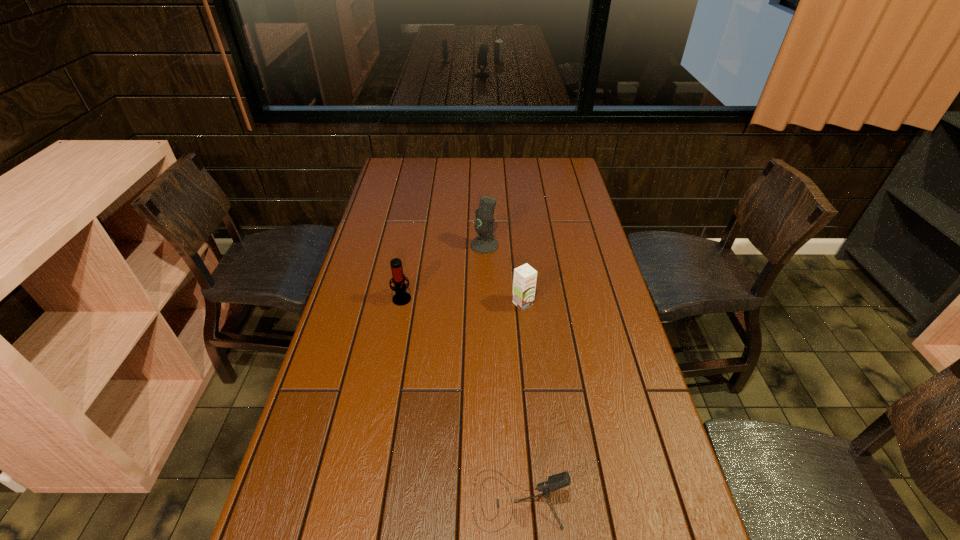
You are a GUI agent. You are given a task and a screenshot of the screen. Output one action in this format:
    pyautogui.click(x=<x>, y=<y>)
    Task: Click on the vacant area that lies between the tallest object and the chocolate milk
    This screenshot has width=960, height=540.
    Given the screenshot: What is the action you would take?
    pyautogui.click(x=504, y=274)

The width and height of the screenshot is (960, 540). In order to click on free space between the nearest microphone and the tallest object in this screenshot , I will do `click(501, 373)`.

I want to click on free space between the chocolate milk and the second nearest microphone, so click(463, 301).

Find the location of a particular element. Image resolution: width=960 pixels, height=540 pixels. vacant point located between the leftmost object and the nearest microphone is located at coordinates (460, 399).

The height and width of the screenshot is (540, 960). What are the coordinates of `free spot between the chocolate milk and the leftmost object` in the screenshot? It's located at (463, 301).

At what (x,y) coordinates should I click in order to perform the action: click on unoccupied area between the second shortest microphone and the shortest object. Please return your answer as a coordinate pair (x, y). The width and height of the screenshot is (960, 540). Looking at the image, I should click on (460, 399).

Where is `vacant region between the nearest object and the chocolate milk`? The width and height of the screenshot is (960, 540). vacant region between the nearest object and the chocolate milk is located at coordinates (520, 402).

Identify the location of vacant area that lies between the leftmost microphone and the chocolate milk. (463, 301).

Identify which object is located as the second nearest to the leftmost microphone. Please provide its 2D coordinates. Your answer should be formatted as a tuple, i.e. [(x, y)], where the tuple contains the x and y coordinates of a point satisfying the conditions above.

[(524, 283)]

Find the location of a particular element. This screenshot has height=540, width=960. object that can be found as the second closest to the second farthest microphone is located at coordinates (524, 283).